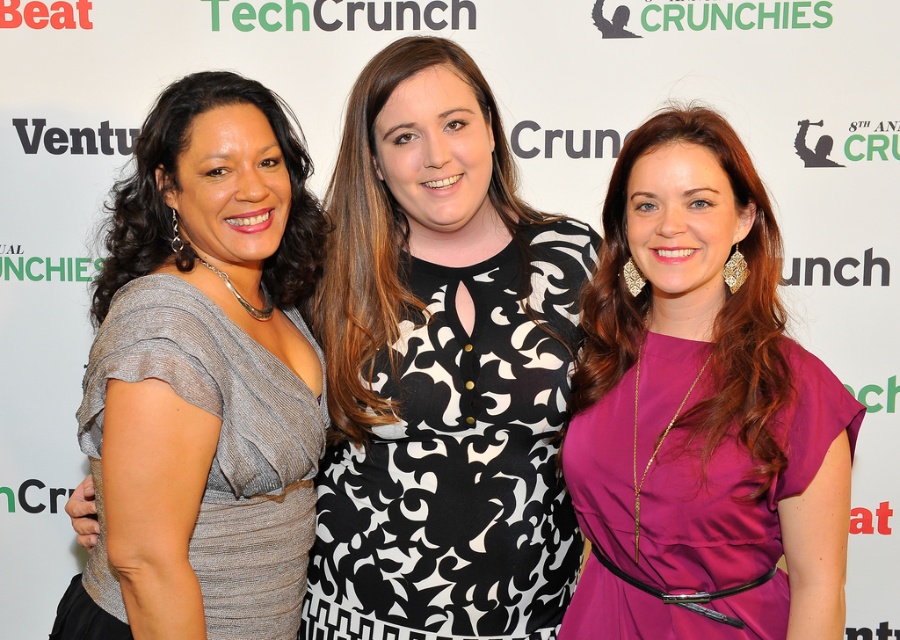
Which is in front, point (495, 163) or point (142, 499)?

Point (142, 499)

Is point (547, 536) positioned before point (182, 292)?

No.

I want to click on black and white patterned dress at center, so click(x=441, y=369).

Can you confirm if black and white patterned dress at center is positioned to the right of purple satin dress at center?

No, black and white patterned dress at center is not to the right of purple satin dress at center.

Which of these two, black and white patterned dress at center or purple satin dress at center, stands taller?

With more height is black and white patterned dress at center.

You are a GUI agent. You are given a task and a screenshot of the screen. Output one action in this format:
    pyautogui.click(x=<x>, y=<y>)
    Task: Click on the black and white patterned dress at center
    The width and height of the screenshot is (900, 640).
    Given the screenshot: What is the action you would take?
    pyautogui.click(x=441, y=369)

Is purple satin dress at center closer to camera compared to shiny silver dress at left?

No.

Is purple satin dress at center below shiny silver dress at left?

Indeed, purple satin dress at center is positioned under shiny silver dress at left.

You are a GUI agent. You are given a task and a screenshot of the screen. Output one action in this format:
    pyautogui.click(x=<x>, y=<y>)
    Task: Click on the purple satin dress at center
    
    Given the screenshot: What is the action you would take?
    pyautogui.click(x=702, y=410)